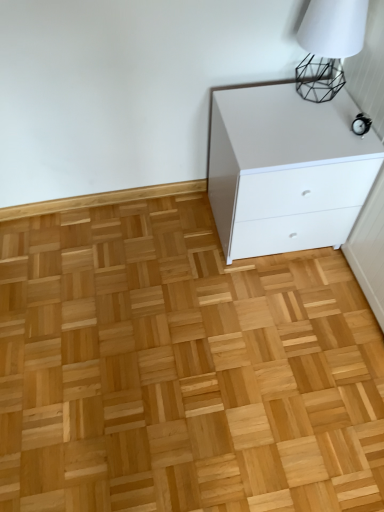
The height and width of the screenshot is (512, 384). In order to click on vacant space underneath white matte table lamp at upper right (from a real-world perspective) in this screenshot , I will do `click(319, 94)`.